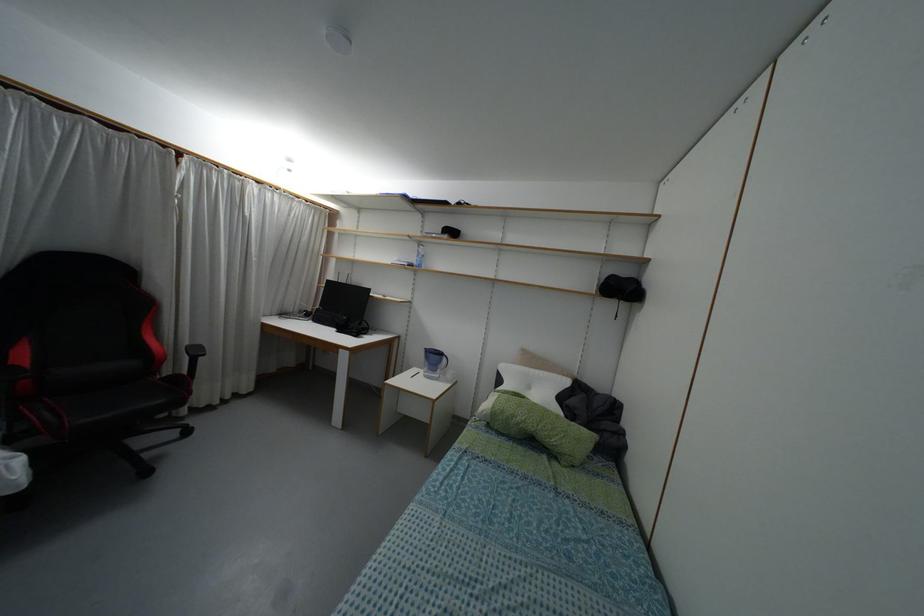
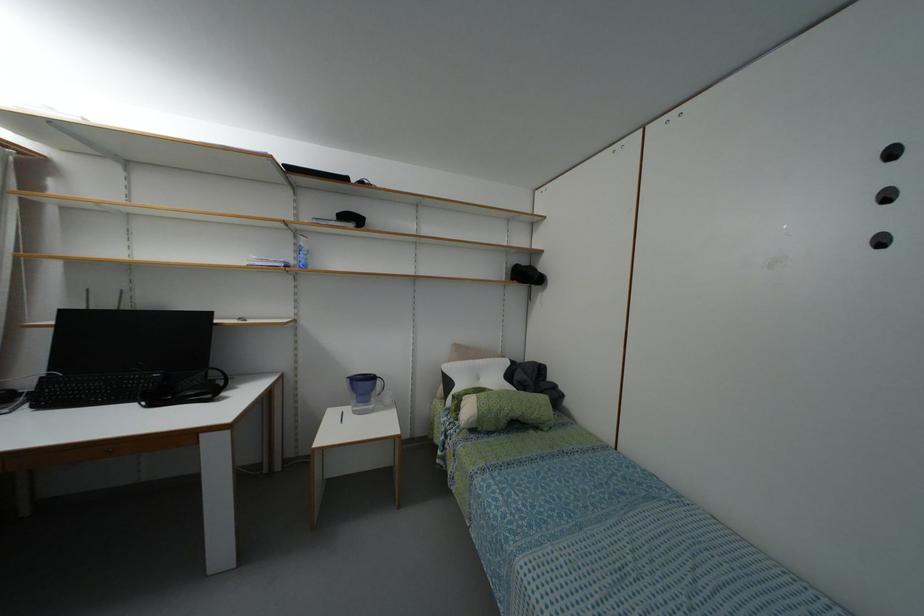
Question: The images are taken continuously from a first-person perspective. In which direction is your viewpoint rotating?

Choices:
 (A) Left
 (B) Right
 (C) Up
 (D) Down

Answer: (B)